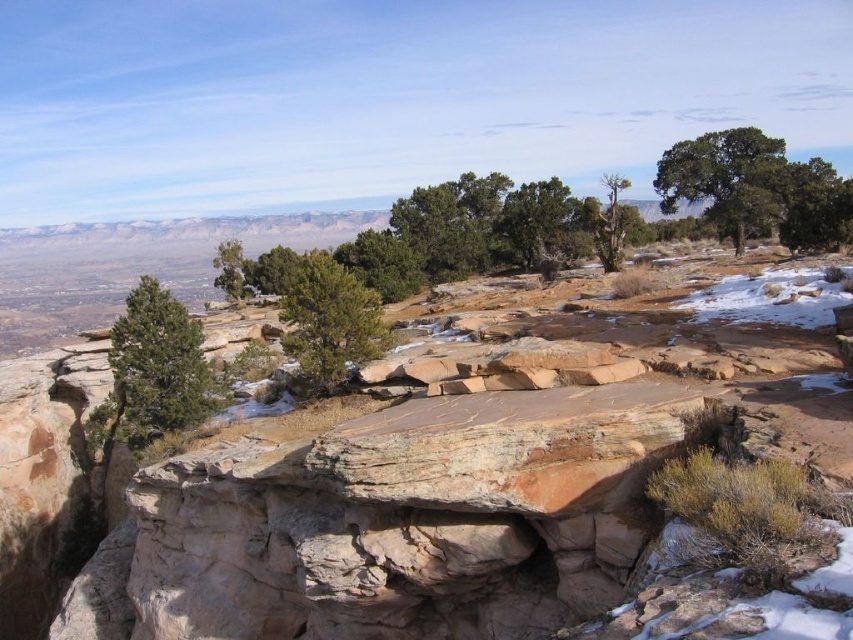
You are a hiker standing at the base of the prominent rock formation in the desert landscape. You want to reach the green leafy tree at upper right. According to the map, your current position is 30 meters away from the nearest snow patch. Can you estimate how far you need to walk to reach the tree?

The green leafy tree at upper right is 42.28 meters away from your current position. Since you are 30 meters away from the nearest snow patch, you need to walk approximately 42.28 meters to reach the tree.

You are a hiker trying to navigate through this desert landscape. You see a green leafy tree at upper right and a green matte tree at center. Which tree should you head towards if you want to find shade from the sun?

The green leafy tree at upper right is taller than the green matte tree at center, so it would provide more shade.